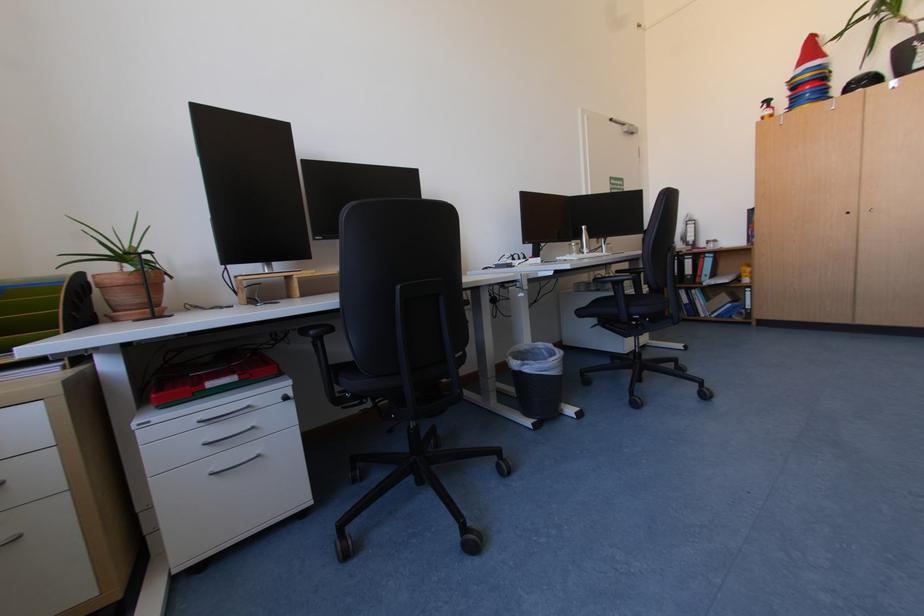
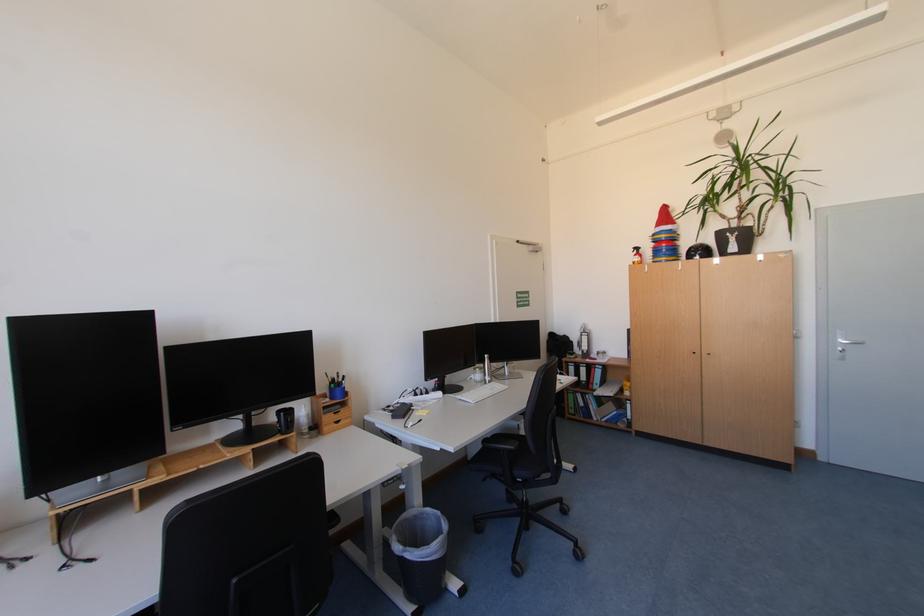
Where in the second image is the point corresponding to the point at 709,261 from the first image?

(601, 370)